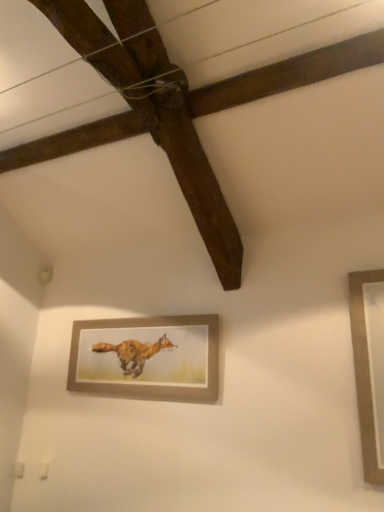
What is the approximate width of matte brown picture frame at center?

The width of matte brown picture frame at center is 4.83 centimeters.

The height and width of the screenshot is (512, 384). What do you see at coordinates (147, 358) in the screenshot?
I see `matte brown picture frame at center` at bounding box center [147, 358].

Identify the location of matte brown picture frame at center. (147, 358).

At what (x,y) coordinates should I click in order to perform the action: click on matte brown picture frame at center. Please return your answer as a coordinate pair (x, y). The image size is (384, 512). Looking at the image, I should click on (147, 358).